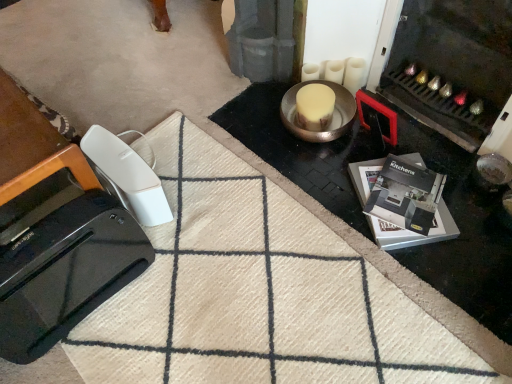
What are the coordinates of `vacant space positioned to the left of black glossy kitchens brochure at lower right` in the screenshot? It's located at (324, 192).